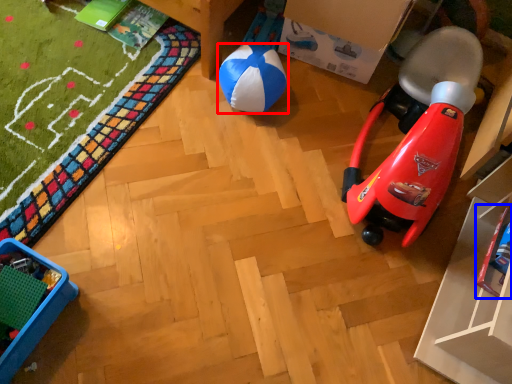
Question: Which object appears closest to the camera in this image, ball (highlighted by a red box) or toy (highlighted by a blue box)?

Choices:
 (A) ball
 (B) toy

Answer: (B)